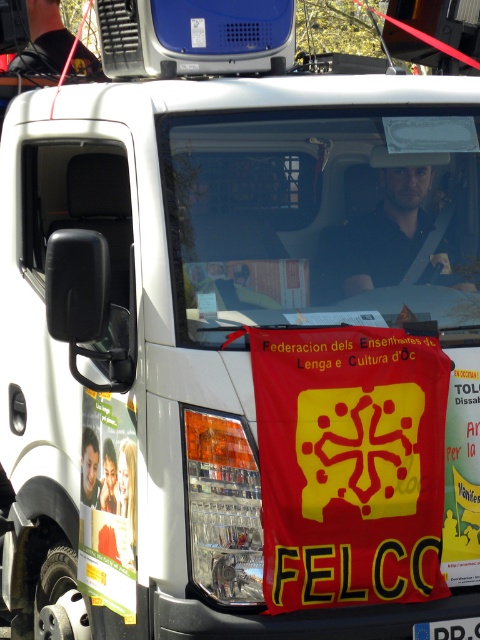
You are standing 10 feet away from the front of the vehicle. You want to take a photo of the banner on the windshield. Is the dark blue shirt at center in your way?

The dark blue shirt at center is 9.45 feet away from the camera. Since you are standing 10 feet away from the front of the vehicle, the dark blue shirt at center is slightly closer to you than the vehicle. Therefore, the dark blue shirt at center would be in your way when taking the photo.

Consider the image. You are standing in front of the vehicle and want to locate the dark blue shirt at center. According to the coordinates provided, where exactly would you find it?

The dark blue shirt at center is located at coordinates point (386, 232).